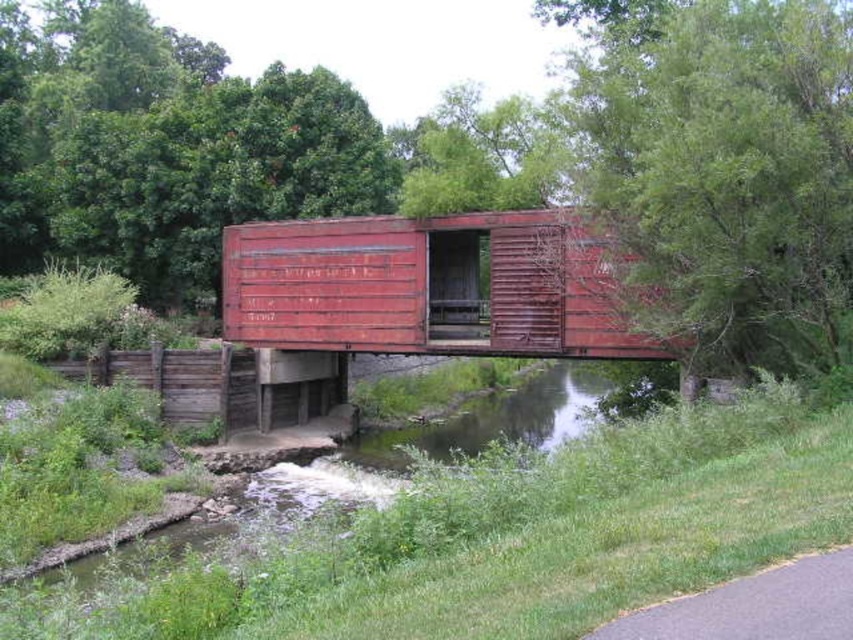
You are standing on the red wooden bridge and want to cross to the other side. There is a rusty metal shipping container at center and a green grassy river at lower center. Which object is closer to your right side?

The green grassy river at lower center is closer to your right side because the rusty metal shipping container at center is to the left of it.